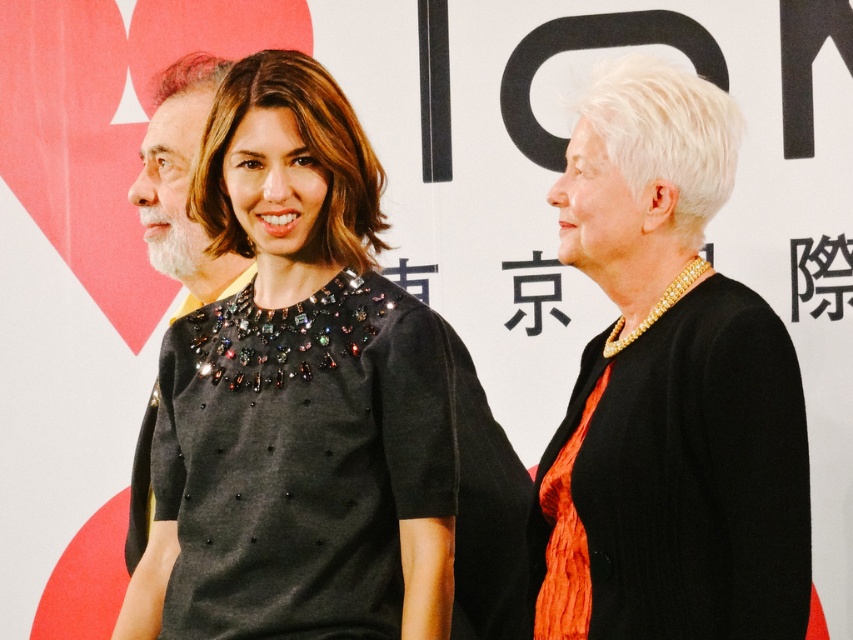
What are the coordinates of the black beaded dress at center?

The black beaded dress at center is located at coordinates point (299, 396).

You are a photographer setting up a camera to capture the three individuals in the scene. You need to ensure that the black beaded dress at center and the matte black dress at right are both fully visible in the frame. Based on their widths, which dress requires more horizontal space to fit entirely within the photo?

The black beaded dress at center might require more horizontal space than the matte black dress at right because it is wider.